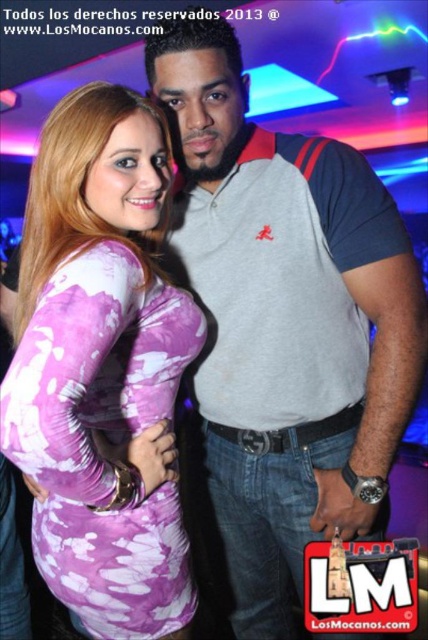
You are a photographer adjusting your camera to focus on the two points in the image, point (392, 272) and point (83, 273). Which point is closer to your camera?

Point (392, 272) is closer to the camera because it is further to the viewer than point (83, 273).